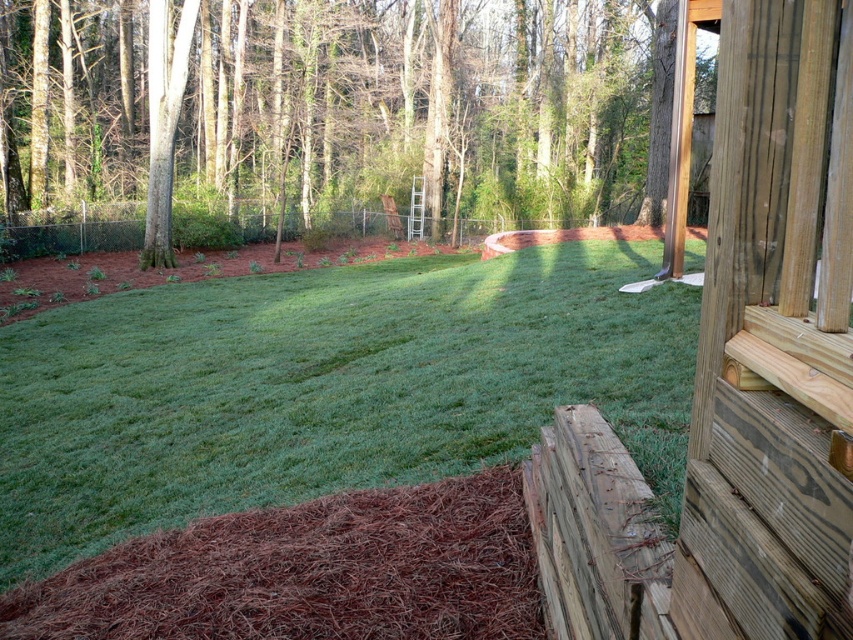
Who is more forward, (602,147) or (561,435)?

Positioned in front is point (561,435).

Locate an element on the screen. brown wood tree at upper left is located at coordinates (328, 116).